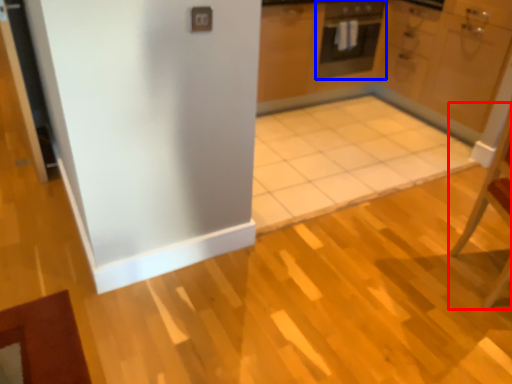
Question: Which of the following is the farthest to the observer, chair (highlighted by a red box) or oven (highlighted by a blue box)?

Choices:
 (A) chair
 (B) oven

Answer: (B)